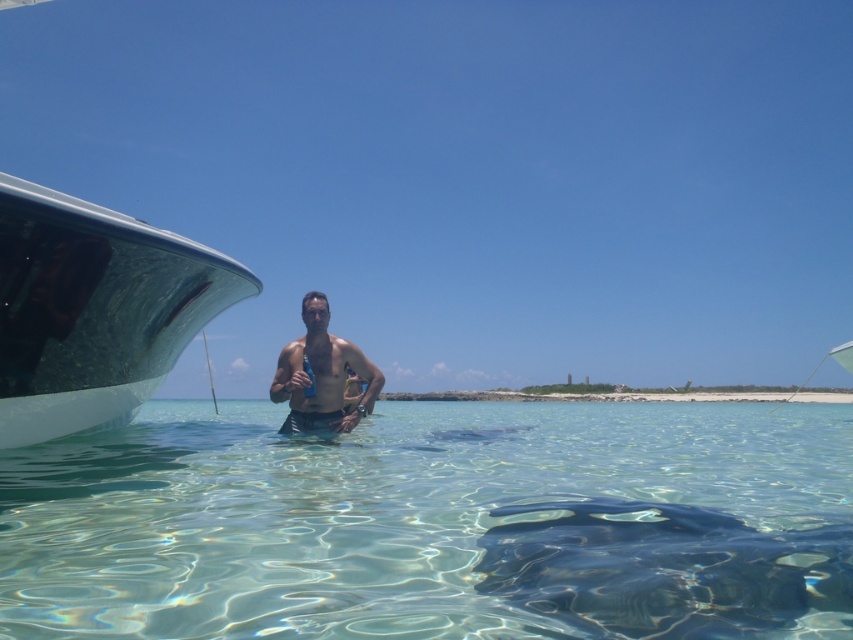
Question: Which object is farther from the camera taking this photo?

Choices:
 (A) smooth skin man at center
 (B) clear water at center
 (C) shiny white boat at left

Answer: (A)

Question: Which of these objects is positioned farthest from the shiny white boat at left?

Choices:
 (A) clear water at center
 (B) smooth skin man at center

Answer: (A)

Question: Which object is the closest to the clear water at center?

Choices:
 (A) shiny white boat at left
 (B) smooth skin man at center

Answer: (B)

Question: Does clear water at center lie in front of shiny white boat at left?

Choices:
 (A) no
 (B) yes

Answer: (B)

Question: Considering the relative positions of clear water at center and smooth skin man at center in the image provided, where is clear water at center located with respect to smooth skin man at center?

Choices:
 (A) above
 (B) below

Answer: (B)

Question: Can you confirm if clear water at center is positioned to the right of shiny white boat at left?

Choices:
 (A) yes
 (B) no

Answer: (A)